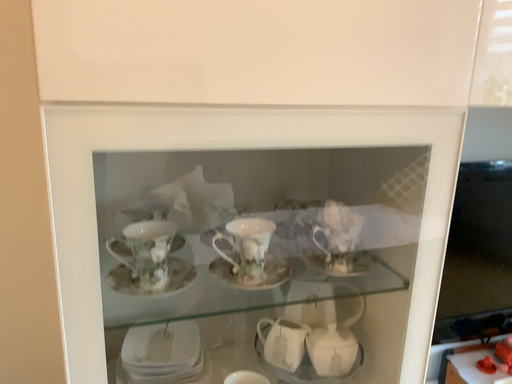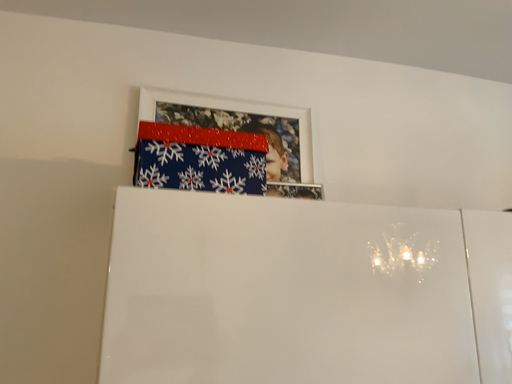
Question: How did the camera likely rotate when shooting the video?

Choices:
 (A) rotated upward
 (B) rotated downward

Answer: (A)